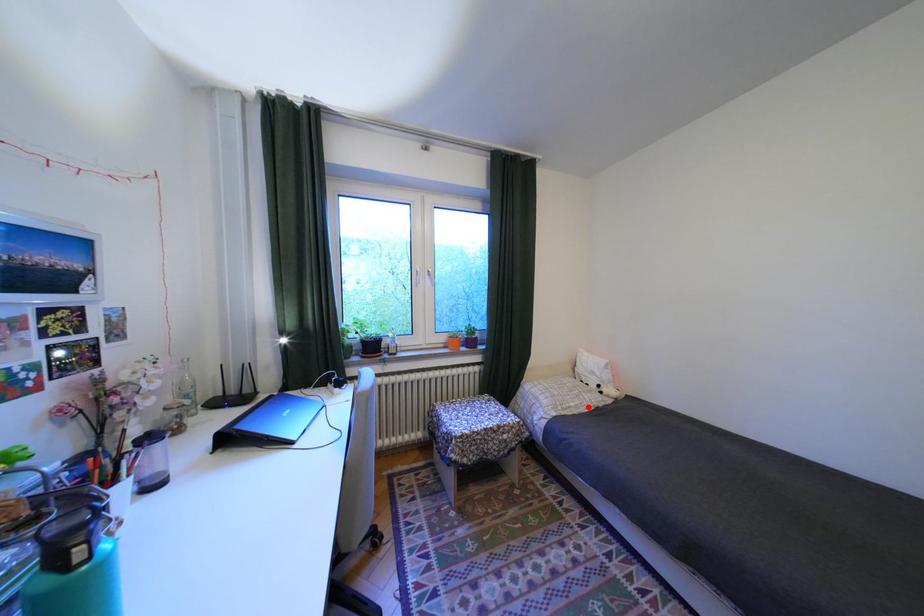
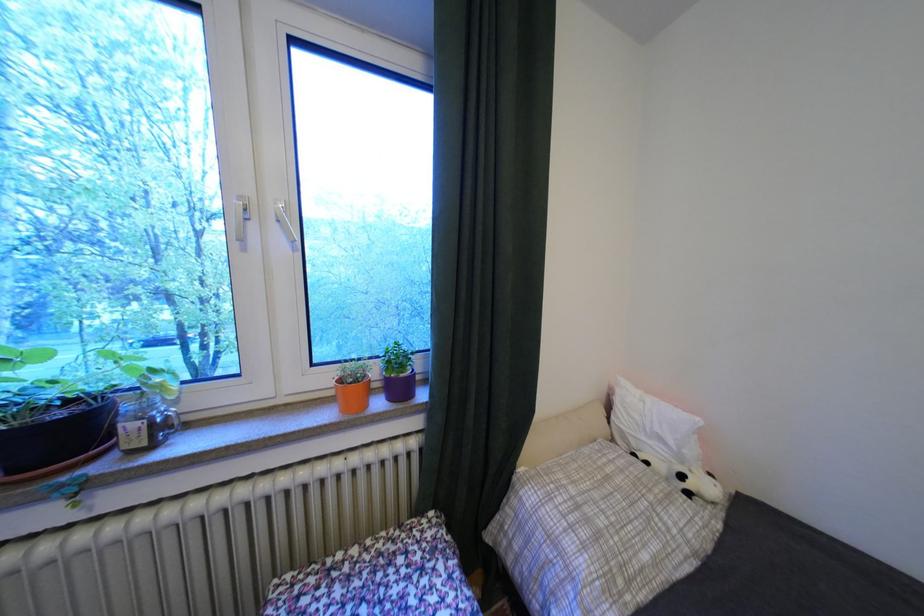
Question: A red point is marked in image1. In image2, is the corresponding 3D point closer to the camera or farther? Reply with the corresponding letter.

Choices:
 (A) The corresponding 3D point is closer.
 (B) The corresponding 3D point is farther.

Answer: (A)